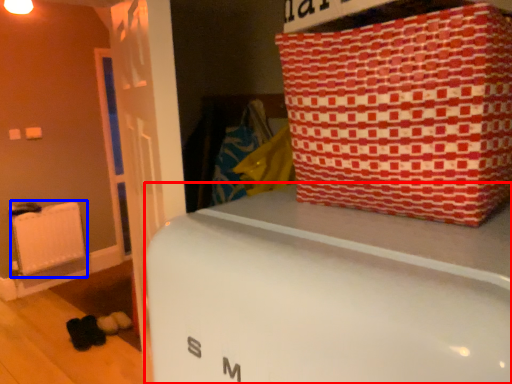
Question: Among these objects, which one is farthest to the camera, furniture (highlighted by a red box) or radiator (highlighted by a blue box)?

Choices:
 (A) furniture
 (B) radiator

Answer: (B)